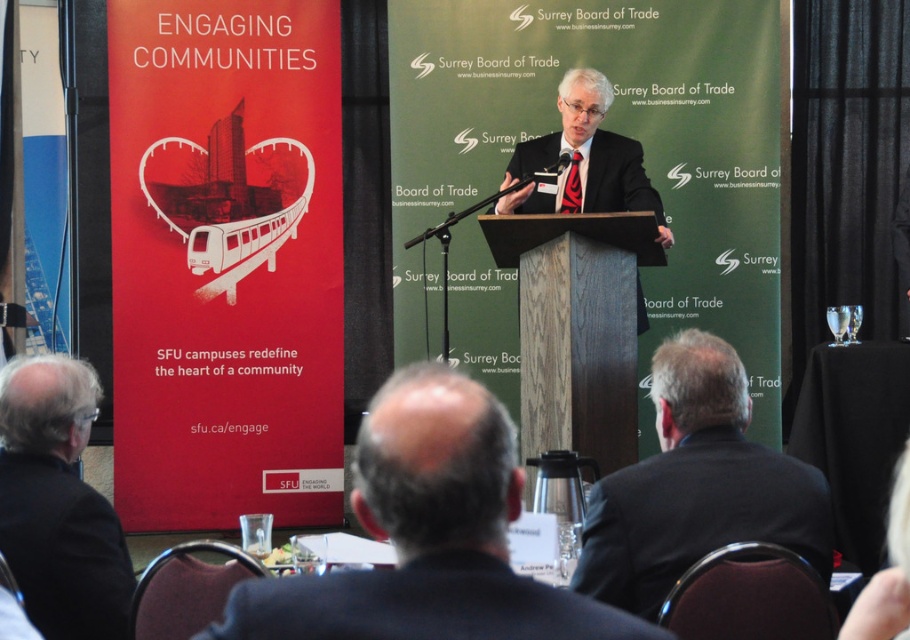
Question: Which is nearer to the black suit at left?

Choices:
 (A) black suit at center
 (B) dark suit at center
 (C) dark blue fabric business suit at center

Answer: (B)

Question: Is black suit at center above matte black suit at center?

Choices:
 (A) yes
 (B) no

Answer: (B)

Question: Is dark suit at center thinner than dark blue fabric business suit at center?

Choices:
 (A) yes
 (B) no

Answer: (B)

Question: Which point is closer to the camera?

Choices:
 (A) dark blue fabric business suit at center
 (B) dark suit at center
 (C) black suit at left

Answer: (A)

Question: Which point appears closest to the camera in this image?

Choices:
 (A) (83, 413)
 (B) (486, 618)

Answer: (B)

Question: Is dark suit at center closer to camera compared to black suit at left?

Choices:
 (A) yes
 (B) no

Answer: (A)